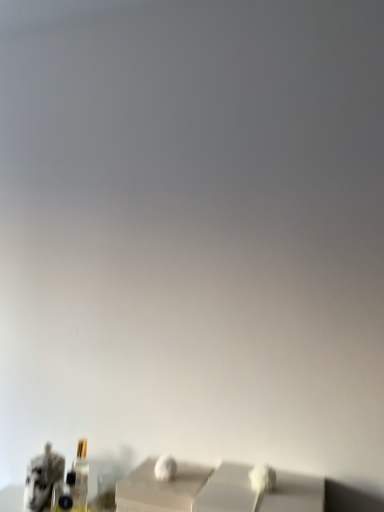
What do you see at coordinates (81, 464) in the screenshot? I see `matte gold bottle at lower left` at bounding box center [81, 464].

Where is `matte gold bottle at lower left`? matte gold bottle at lower left is located at coordinates (81, 464).

Image resolution: width=384 pixels, height=512 pixels. Describe the element at coordinates (42, 478) in the screenshot. I see `camouflage-patterned figurine at lower left` at that location.

Locate an element on the screen. The image size is (384, 512). camouflage-patterned figurine at lower left is located at coordinates (42, 478).

At what (x,y) coordinates should I click in order to perform the action: click on matte gold bottle at lower left. Please return your answer as a coordinate pair (x, y). Looking at the image, I should click on tap(81, 464).

Considering the relative positions of matte gold bottle at lower left and camouflage-patterned figurine at lower left in the image provided, is matte gold bottle at lower left to the right of camouflage-patterned figurine at lower left from the viewer's perspective?

Correct, you'll find matte gold bottle at lower left to the right of camouflage-patterned figurine at lower left.

Is the position of matte gold bottle at lower left less distant than that of camouflage-patterned figurine at lower left?

No, the depth of matte gold bottle at lower left is greater than that of camouflage-patterned figurine at lower left.

Which is farther, [86,462] or [29,478]?

Positioned behind is point [86,462].

From the image's perspective, is matte gold bottle at lower left beneath camouflage-patterned figurine at lower left?

Incorrect, from the image's perspective, matte gold bottle at lower left is higher than camouflage-patterned figurine at lower left.

From a real-world perspective, is matte gold bottle at lower left physically below camouflage-patterned figurine at lower left?

Incorrect, from a real-world perspective, matte gold bottle at lower left is higher than camouflage-patterned figurine at lower left.

Is matte gold bottle at lower left wider than camouflage-patterned figurine at lower left?

No, matte gold bottle at lower left is not wider than camouflage-patterned figurine at lower left.

Can you confirm if matte gold bottle at lower left is shorter than camouflage-patterned figurine at lower left?

In fact, matte gold bottle at lower left may be taller than camouflage-patterned figurine at lower left.

Does matte gold bottle at lower left have a larger size compared to camouflage-patterned figurine at lower left?

No, matte gold bottle at lower left is not bigger than camouflage-patterned figurine at lower left.

Can camouflage-patterned figurine at lower left be found inside matte gold bottle at lower left?

Actually, camouflage-patterned figurine at lower left is outside matte gold bottle at lower left.

In the scene shown: Is matte gold bottle at lower left placed right next to camouflage-patterned figurine at lower left?

Yes.

Is matte gold bottle at lower left looking in the opposite direction of camouflage-patterned figurine at lower left?

No, matte gold bottle at lower left is not facing away from camouflage-patterned figurine at lower left.

Can you tell me how much matte gold bottle at lower left and camouflage-patterned figurine at lower left differ in facing direction?

The facing directions of matte gold bottle at lower left and camouflage-patterned figurine at lower left are 0.91 degrees apart.

Measure the distance between matte gold bottle at lower left and camouflage-patterned figurine at lower left.

matte gold bottle at lower left is 3.10 inches from camouflage-patterned figurine at lower left.

Find the location of a particular element. This screenshot has width=384, height=512. bottle above the camouflage-patterned figurine at lower left (from the image's perspective) is located at coordinates (81, 464).

Is camouflage-patterned figurine at lower left at the left side of matte gold bottle at lower left?

Correct, you'll find camouflage-patterned figurine at lower left to the left of matte gold bottle at lower left.

Is camouflage-patterned figurine at lower left positioned in front of matte gold bottle at lower left?

Yes, it is in front of matte gold bottle at lower left.

Is point (51, 474) farther from viewer compared to point (80, 482)?

No.

From the image's perspective, is camouflage-patterned figurine at lower left located above matte gold bottle at lower left?

No, from the image's perspective, camouflage-patterned figurine at lower left is not above matte gold bottle at lower left.

From a real-world perspective, who is located lower, camouflage-patterned figurine at lower left or matte gold bottle at lower left?

camouflage-patterned figurine at lower left is physically lower.

From the picture: Which of these two, camouflage-patterned figurine at lower left or matte gold bottle at lower left, is thinner?

matte gold bottle at lower left is thinner.

Does camouflage-patterned figurine at lower left have a lesser height compared to matte gold bottle at lower left?

Indeed, camouflage-patterned figurine at lower left has a lesser height compared to matte gold bottle at lower left.

Between camouflage-patterned figurine at lower left and matte gold bottle at lower left, which one has larger size?

camouflage-patterned figurine at lower left.

Would you say camouflage-patterned figurine at lower left contains matte gold bottle at lower left?

Actually, matte gold bottle at lower left is outside camouflage-patterned figurine at lower left.

Are camouflage-patterned figurine at lower left and matte gold bottle at lower left far apart?

No, there isn't a large distance between camouflage-patterned figurine at lower left and matte gold bottle at lower left.

Is camouflage-patterned figurine at lower left turned away from matte gold bottle at lower left?

No.

Can you tell me how much camouflage-patterned figurine at lower left and matte gold bottle at lower left differ in facing direction?

The angular difference between camouflage-patterned figurine at lower left and matte gold bottle at lower left is 0.91 degrees.

Where is `bottle that is on the right side of camouflage-patterned figurine at lower left`? bottle that is on the right side of camouflage-patterned figurine at lower left is located at coordinates pyautogui.click(x=81, y=464).

You are a GUI agent. You are given a task and a screenshot of the screen. Output one action in this format:
    pyautogui.click(x=<x>, y=<y>)
    Task: Click on the bottle behind the camouflage-patterned figurine at lower left
    The width and height of the screenshot is (384, 512).
    Given the screenshot: What is the action you would take?
    pyautogui.click(x=81, y=464)

Where is `animal located below the matte gold bottle at lower left (from the image's perspective)`? Image resolution: width=384 pixels, height=512 pixels. animal located below the matte gold bottle at lower left (from the image's perspective) is located at coordinates click(x=42, y=478).